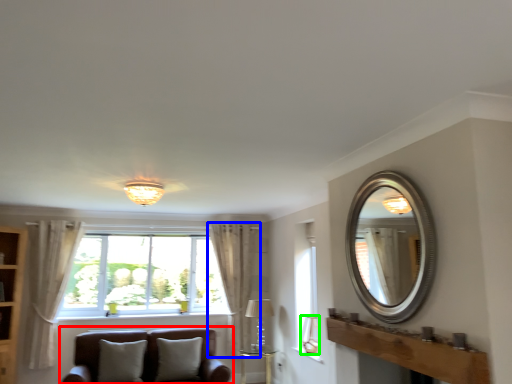
Question: Considering the real-world distances, which object is farthest from studio couch (highlighted by a red box)? curtain (highlighted by a blue box) or lamp (highlighted by a green box)?

Choices:
 (A) curtain
 (B) lamp

Answer: (B)